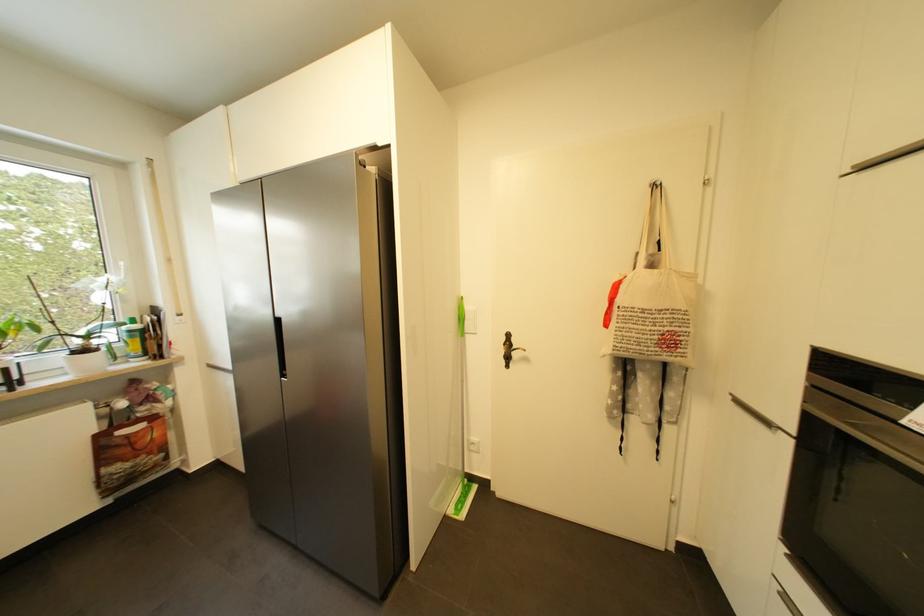
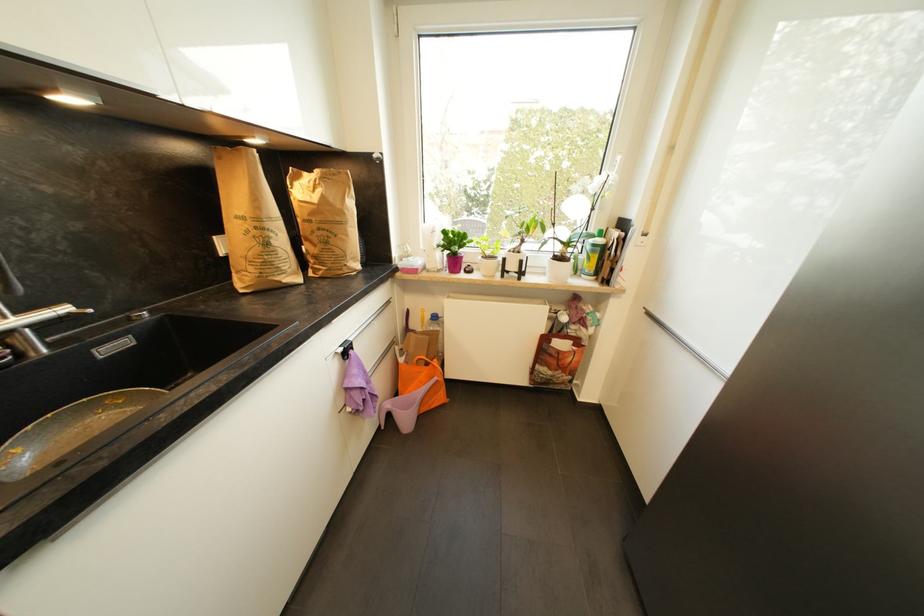
Where in the second image is the point corresponding to point (132, 467) from the first image?

(554, 375)